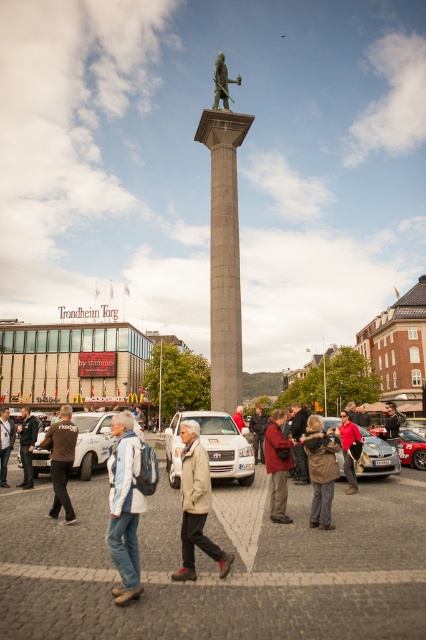
You are standing in the square and want to walk from point (x=227, y=131) to point (x=23, y=486). Which direction should you move relative to your current position?

You should move away from the viewer because point (x=227, y=131) is closer to the viewer than point (x=23, y=486).

You are standing in the square and want to take a photo of the column. You notice two points marked in the scene, point [273,516] and point [354,451]. Which point is better to stand at to get a closer view of the column?

Point [273,516] is closer to the viewer than point [354,451], so standing at point [273,516] would provide a closer view of the column.